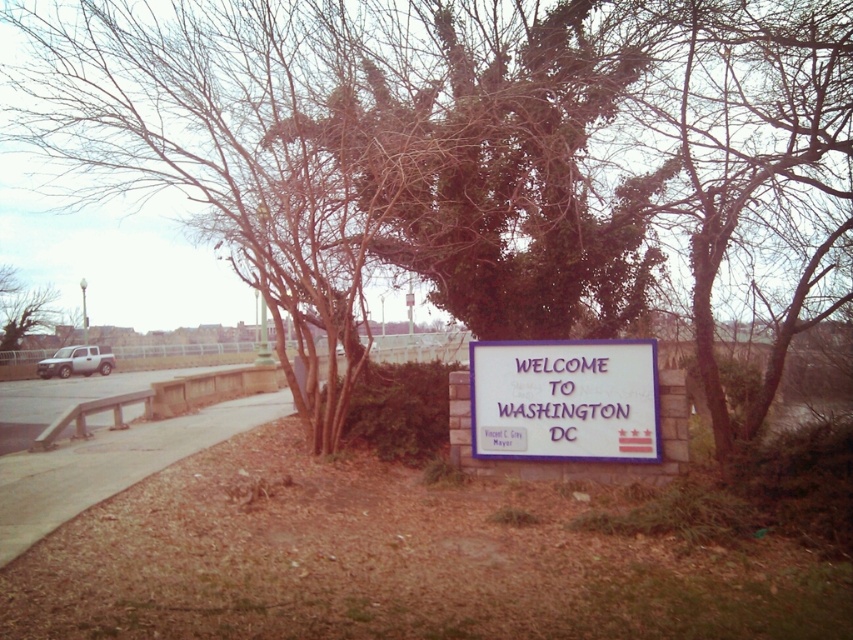
You are a tour guide leading a group to the sign. You want to ensure everyone can walk from the brown concrete sidewalk at lower left to the white matte sign at center. Is the sidewalk wide enough for a group to walk comfortably?

The white matte sign at center is smaller than the brown concrete sidewalk at lower left, which means the sidewalk is wide enough for a group to walk comfortably to the sign.